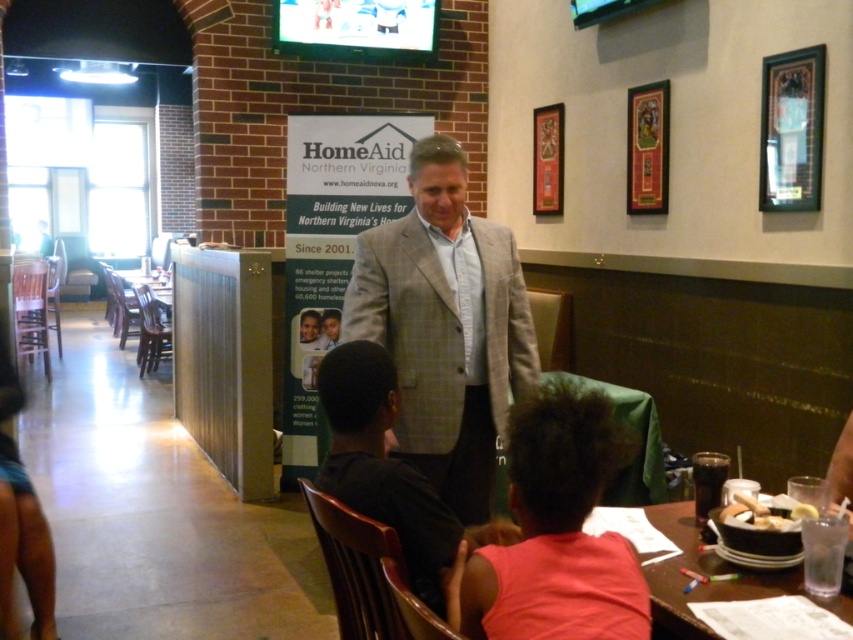
You are at a restaurant and want to move from point A to point B. Point A is located at coordinate point point (424, 397) and point B is at point (669, 588). Which point is closer to you when you start at point A?

Point A is closer to you because it is the starting point, but according to the description, point (424, 397) is further to the viewer than point (669, 588). Wait, that seems contradictory. Let me check again. The description says point (424, 397) is further to the viewer than point (669, 588). So when starting at point A, point B is closer to you since point A is further away. Therefore, point B is closer.

You are a customer at this restaurant and want to order a piece of bread. You see the gray plaid suit at center and the white bread at lower right. Which object is closer to your current position if you are standing at the entrance?

The gray plaid suit at center is closer to you since it is positioned to the left of the white bread at lower right, meaning it is between you and the white bread at lower right from your entrance position.

You are a customer in this restaurant and want to sit at the table where the children are sitting. The server is standing at point (445, 326). Is the server blocking your path to the children table?

The server is standing at point (445, 326) where the gray plaid suit at center is located. Since the gray plaid suit at center is part of the server, the server is indeed blocking your path to the children table.